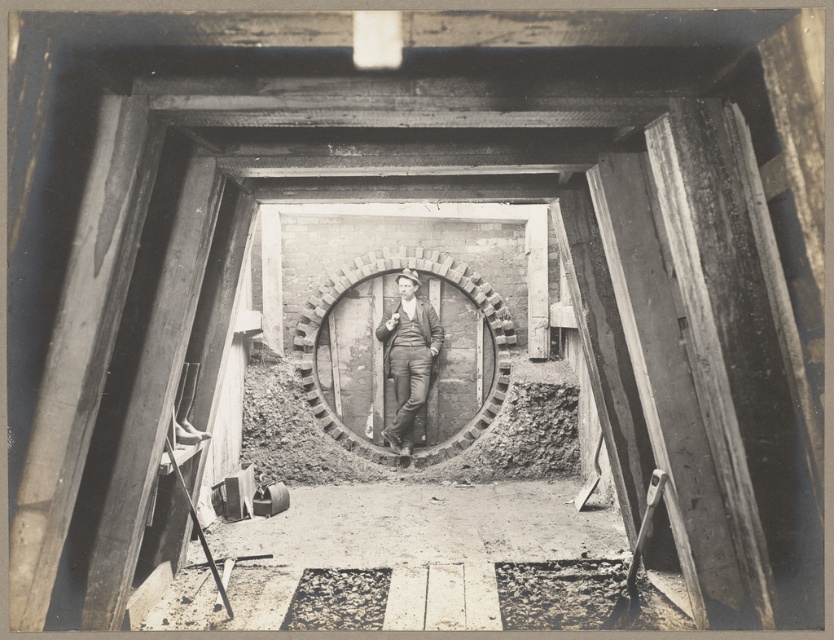
You are a photographer in the early 20th century, and you need to position a tripod between the brick at center and the matte black suit at center. Which object should the tripod be placed closer to if you want it to be on the right side of the scene?

The brick at center is to the left of the matte black suit at center. To place the tripod on the right side, it should be closer to the matte black suit at center.

You are a photographer in the early 20th century taking a picture of a construction site. You notice a brick at center and a matte black suit at center. Which object is closer to the camera?

The brick at center is in front of the matte black suit at center, so it is closer to the camera.